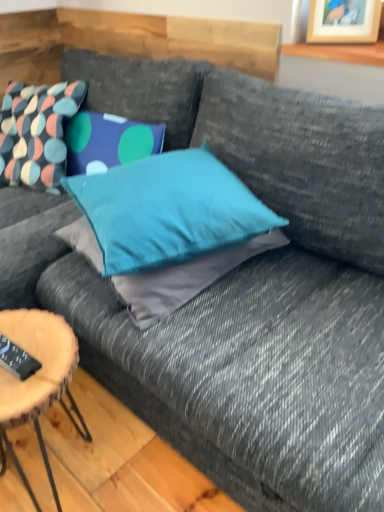
Question: Is multicolored fabric pillow at upper left, placed as the second pillow when sorted from right to left, outside of black plastic remote control at lower left?

Choices:
 (A) no
 (B) yes

Answer: (B)

Question: Is multicolored fabric pillow at upper left, positioned as the first pillow in back-to-front order, taller than black plastic remote control at lower left?

Choices:
 (A) yes
 (B) no

Answer: (A)

Question: Is black plastic remote control at lower left completely or partially inside multicolored fabric pillow at upper left, the 2th pillow viewed from the front?

Choices:
 (A) no
 (B) yes

Answer: (A)

Question: Is multicolored fabric pillow at upper left, positioned as the first pillow in back-to-front order, turned away from black plastic remote control at lower left?

Choices:
 (A) no
 (B) yes

Answer: (A)

Question: Considering the relative positions of multicolored fabric pillow at upper left, the 2th pillow viewed from the front, and black plastic remote control at lower left in the image provided, is multicolored fabric pillow at upper left, the 2th pillow viewed from the front, to the right of black plastic remote control at lower left from the viewer's perspective?

Choices:
 (A) no
 (B) yes

Answer: (A)

Question: Relative to black plastic remote control at lower left, is wooden log coffee table at lower left in front or behind?

Choices:
 (A) behind
 (B) front

Answer: (B)

Question: Is wooden log coffee table at lower left to the left or to the right of black plastic remote control at lower left in the image?

Choices:
 (A) left
 (B) right

Answer: (B)

Question: Does point (6, 382) appear closer or farther from the camera than point (21, 357)?

Choices:
 (A) closer
 (B) farther

Answer: (A)

Question: In terms of height, does wooden log coffee table at lower left look taller or shorter compared to black plastic remote control at lower left?

Choices:
 (A) short
 (B) tall

Answer: (B)

Question: Is point (344, 5) positioned closer to the camera than point (1, 359)?

Choices:
 (A) closer
 (B) farther

Answer: (B)

Question: Looking at the image, does wooden picture frame at upper right seem bigger or smaller compared to black plastic remote control at lower left?

Choices:
 (A) big
 (B) small

Answer: (A)

Question: Considering the relative positions of wooden picture frame at upper right and black plastic remote control at lower left in the image provided, is wooden picture frame at upper right to the left or to the right of black plastic remote control at lower left?

Choices:
 (A) left
 (B) right

Answer: (B)

Question: Is wooden picture frame at upper right taller or shorter than black plastic remote control at lower left?

Choices:
 (A) short
 (B) tall

Answer: (B)

Question: Considering the positions of point (105, 218) and point (36, 359), is point (105, 218) closer or farther from the camera than point (36, 359)?

Choices:
 (A) closer
 (B) farther

Answer: (B)

Question: Is teal fabric pillow at center, arranged as the first pillow when viewed from the front, inside or outside of black plastic remote control at lower left?

Choices:
 (A) inside
 (B) outside

Answer: (B)